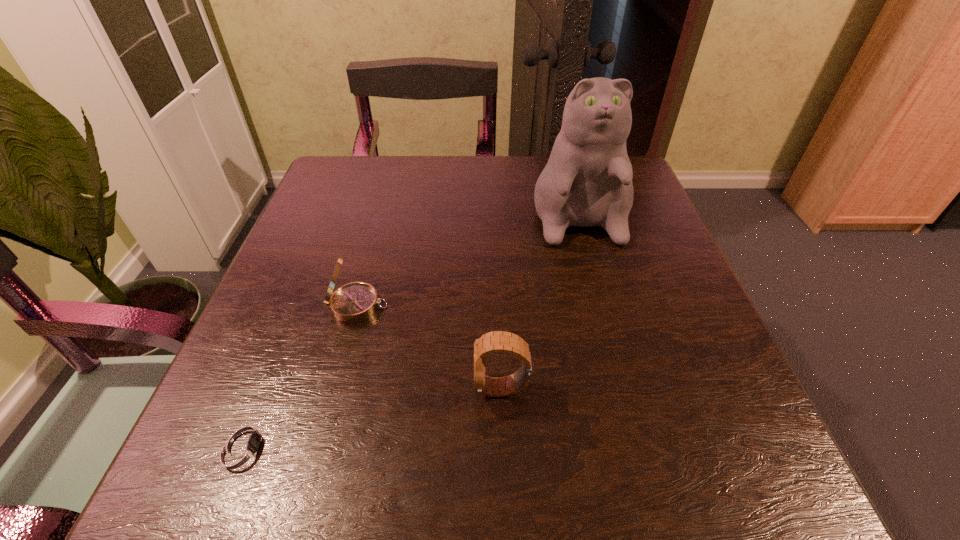
Image resolution: width=960 pixels, height=540 pixels. I want to click on vacant space located on the face of the third farthest object, so click(362, 388).

Where is `vacant space located on the face of the third farthest object`? The width and height of the screenshot is (960, 540). vacant space located on the face of the third farthest object is located at coordinates (282, 388).

The height and width of the screenshot is (540, 960). I want to click on vacant space located 0.330m with the dial facing the third object from right to left, so click(x=573, y=306).

At what (x,y) coordinates should I click in order to perform the action: click on vacant space located 0.190m on the face of the nearer watch. Please return your answer as a coordinate pair (x, y). Looking at the image, I should click on (422, 446).

Find the location of `object that is positioned at the far edge`. object that is positioned at the far edge is located at coordinates (587, 181).

Where is `object that is at the near edge`? The image size is (960, 540). object that is at the near edge is located at coordinates (242, 448).

Where is `compass positioned at the left edge`? Image resolution: width=960 pixels, height=540 pixels. compass positioned at the left edge is located at coordinates (355, 302).

Identify the location of watch located in the left edge section of the desktop. (242, 448).

This screenshot has height=540, width=960. I want to click on object at the right edge, so click(587, 181).

The width and height of the screenshot is (960, 540). Identify the location of object located at the near left corner. (242, 448).